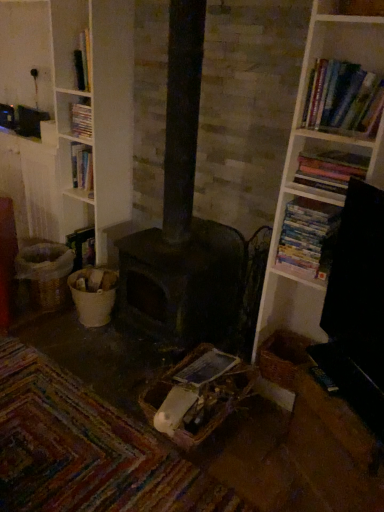
Question: From a real-world perspective, is hardcover book at upper left, which is counted as the fourth book, starting from the front, located beneath dark matte heater at center?

Choices:
 (A) yes
 (B) no

Answer: (B)

Question: Could you tell me if hardcover book at upper left, the 1th book in the left-to-right sequence, is turned towards dark matte heater at center?

Choices:
 (A) no
 (B) yes

Answer: (A)

Question: Considering the relative positions of hardcover book at upper left, the 1th book in the left-to-right sequence, and dark matte heater at center in the image provided, is hardcover book at upper left, the 1th book in the left-to-right sequence, to the right of dark matte heater at center from the viewer's perspective?

Choices:
 (A) no
 (B) yes

Answer: (A)

Question: Can you confirm if hardcover book at upper left, which ranks as the 4th book in right-to-left order, is bigger than dark matte heater at center?

Choices:
 (A) yes
 (B) no

Answer: (B)

Question: From the image's perspective, is hardcover book at upper left, which ranks as the 4th book in right-to-left order, on dark matte heater at center?

Choices:
 (A) no
 (B) yes

Answer: (B)

Question: Considering the relative sizes of hardcover book at upper left, the 1th book in the left-to-right sequence, and dark matte heater at center in the image provided, is hardcover book at upper left, the 1th book in the left-to-right sequence, shorter than dark matte heater at center?

Choices:
 (A) yes
 (B) no

Answer: (A)

Question: From a real-world perspective, is hardcover books at upper right, which appears as the second book when viewed from the front, located higher than white paperbacks at right, the third book in the right-to-left sequence?

Choices:
 (A) no
 (B) yes

Answer: (B)

Question: Considering the relative sizes of hardcover books at upper right, which is counted as the third book, starting from the left, and white paperbacks at right, which is the 2th book in back-to-front order, in the image provided, is hardcover books at upper right, which is counted as the third book, starting from the left, wider than white paperbacks at right, which is the 2th book in back-to-front order,?

Choices:
 (A) yes
 (B) no

Answer: (A)

Question: Can you confirm if hardcover books at upper right, which appears as the 2th book when viewed from the right, is shorter than white paperbacks at right, arranged as the second book when viewed from the left?

Choices:
 (A) no
 (B) yes

Answer: (B)

Question: Are hardcover books at upper right, which appears as the 2th book when viewed from the right, and white paperbacks at right, arranged as the third book when viewed from the front, located far from each other?

Choices:
 (A) no
 (B) yes

Answer: (A)

Question: Is hardcover books at upper right, which appears as the 2th book when viewed from the right, further to camera compared to white paperbacks at right, arranged as the third book when viewed from the front?

Choices:
 (A) yes
 (B) no

Answer: (B)

Question: From the image's perspective, is hardcover books at upper right, which appears as the 2th book when viewed from the right, beneath white paperbacks at right, arranged as the second book when viewed from the left?

Choices:
 (A) yes
 (B) no

Answer: (B)

Question: Is dark matte heater at center not inside hardcover book at upper left, which is counted as the fourth book, starting from the front?

Choices:
 (A) no
 (B) yes

Answer: (B)